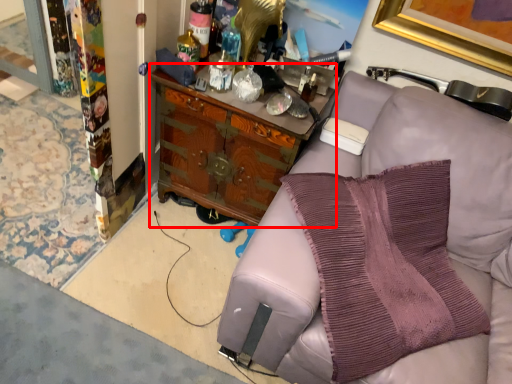
Question: From the image's perspective, considering the relative positions of cabinetry (annotated by the red box) and pillow in the image provided, where is cabinetry (annotated by the red box) located with respect to the staircase?

Choices:
 (A) above
 (B) below

Answer: (A)